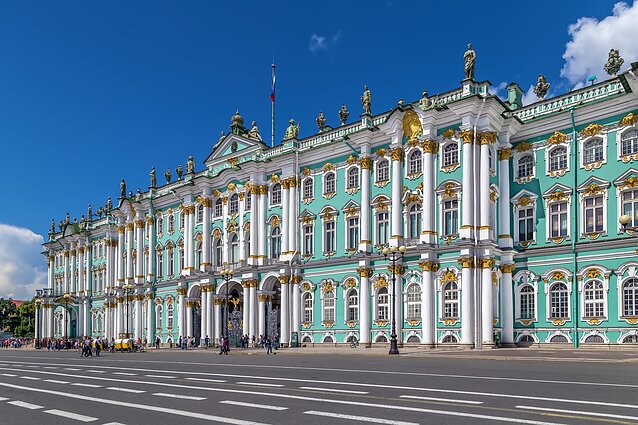
Identify the location of entrances. This screenshot has width=638, height=425. (235, 319), (272, 312), (197, 321).